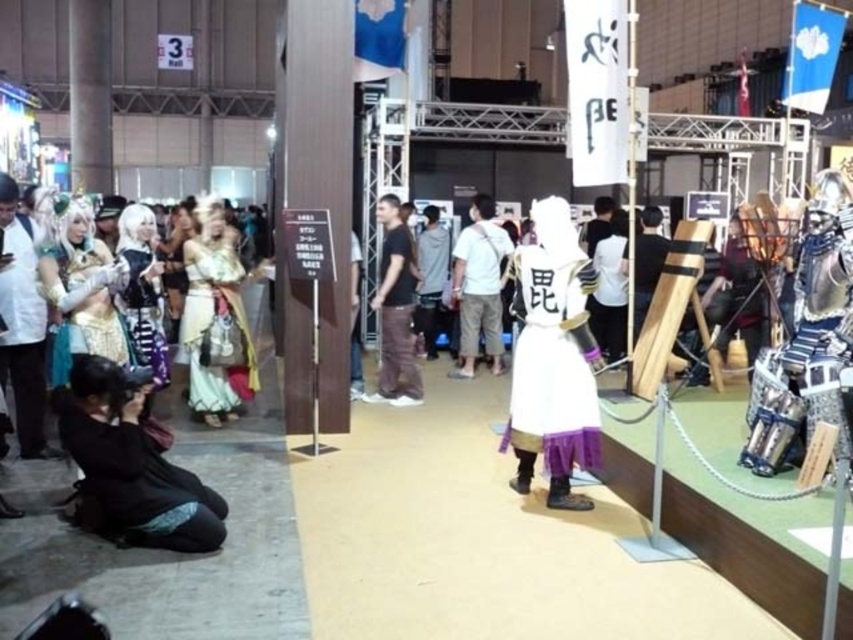
Question: Considering the real-world distances, which object is closest to the white lace dress at center?

Choices:
 (A) white cotton shirt at center
 (B) black fabric outfit at lower left
 (C) light gray cotton shirt at center

Answer: (B)

Question: Does black fabric outfit at lower left come in front of white lace dress at center?

Choices:
 (A) no
 (B) yes

Answer: (B)

Question: From the image, what is the correct spatial relationship of white matte dress at center in relation to light gray cotton shirt at center?

Choices:
 (A) below
 (B) above

Answer: (A)

Question: Estimate the real-world distances between objects in this image. Which object is farther from the light gray cotton shirt at center?

Choices:
 (A) black fabric outfit at lower left
 (B) white lace dress at center

Answer: (A)

Question: Considering the relative positions of white lace dress at center and black cotton t-shirt at center in the image provided, where is white lace dress at center located with respect to black cotton t-shirt at center?

Choices:
 (A) left
 (B) right

Answer: (A)

Question: Which point is farther to the camera?

Choices:
 (A) (70, 435)
 (B) (434, 268)

Answer: (B)